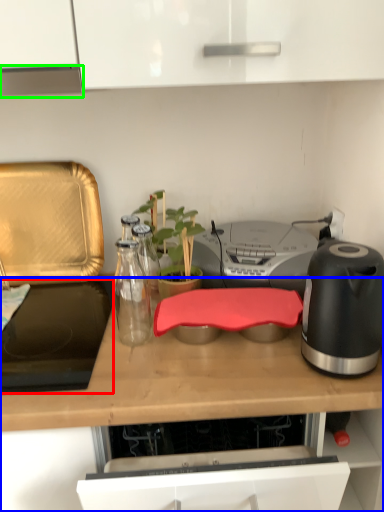
Question: Which is nearer to the gas stove (highlighted by a red box)? countertop (highlighted by a blue box) or exhaust hood (highlighted by a green box).

Choices:
 (A) countertop
 (B) exhaust hood

Answer: (A)